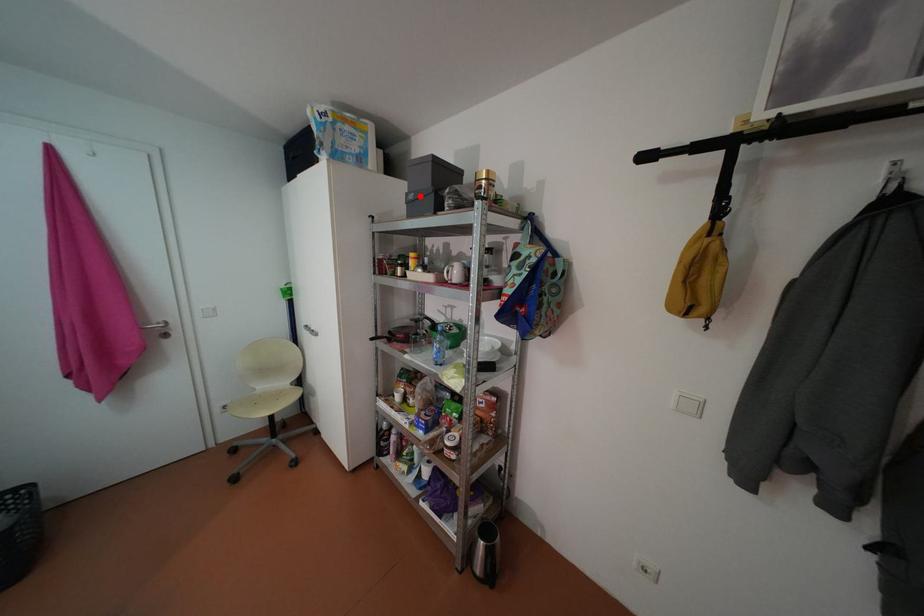
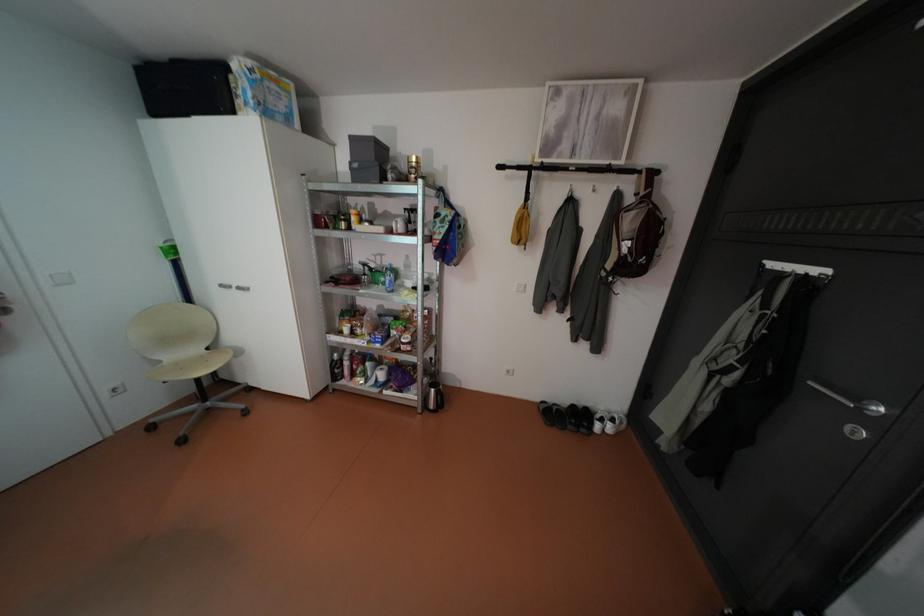
In the second image, find the point that corresponds to the highlighted location in the first image.

(365, 164)